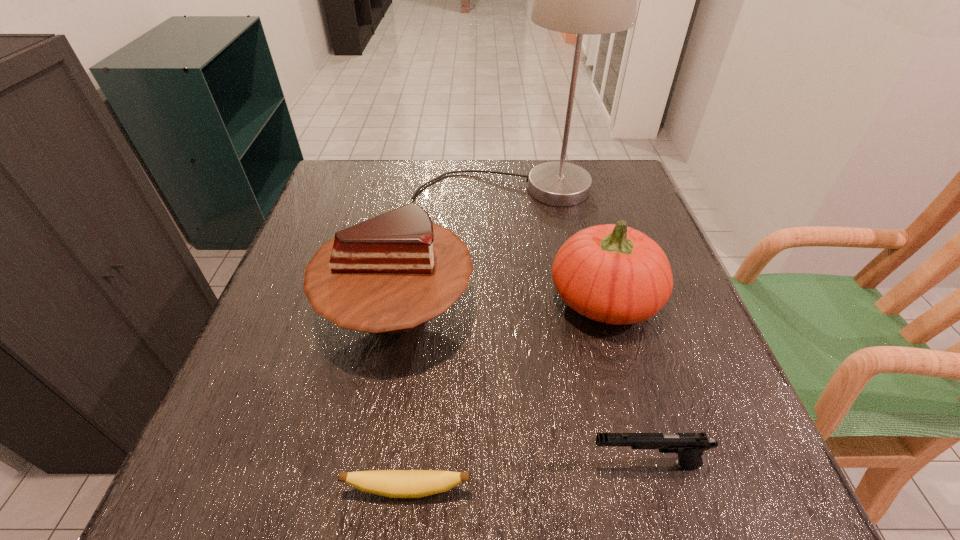
You are a GUI agent. You are given a task and a screenshot of the screen. Output one action in this format:
    pyautogui.click(x=<x>, y=<y>)
    Task: Click on the pumpkin that is at the right edge
    The image size is (960, 540).
    Given the screenshot: What is the action you would take?
    (x=611, y=273)

Where is `gun at the right edge`? This screenshot has width=960, height=540. gun at the right edge is located at coordinates (689, 446).

Where is `object that is at the far right corner`? The width and height of the screenshot is (960, 540). object that is at the far right corner is located at coordinates (579, 0).

This screenshot has width=960, height=540. In order to click on object at the near right corner in this screenshot , I will do `click(689, 446)`.

In the image, there is a desktop. Where is `vacant space at the far edge`? vacant space at the far edge is located at coordinates (486, 161).

This screenshot has width=960, height=540. I want to click on vacant area at the near edge, so click(618, 503).

The width and height of the screenshot is (960, 540). I want to click on vacant space at the left edge of the desktop, so (x=301, y=245).

I want to click on vacant area at the right edge, so click(660, 414).

Identify the location of vacant space at the far left corner of the desktop. (342, 165).

This screenshot has height=540, width=960. In the image, there is a desktop. Identify the location of vacant space at the near left corner. pos(195,458).